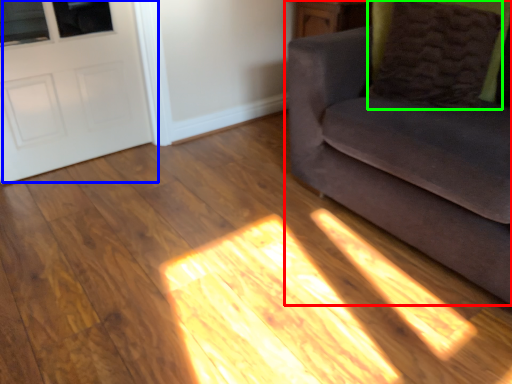
Question: Based on their relative distances, which object is nearer to studio couch (highlighted by a red box)? Choose from door (highlighted by a blue box) and pillow (highlighted by a green box).

Choices:
 (A) door
 (B) pillow

Answer: (B)